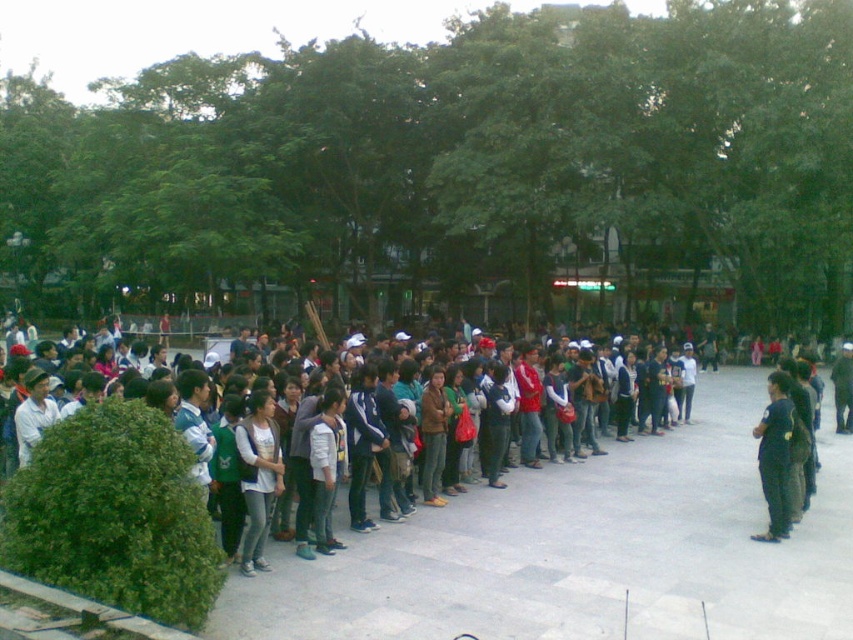
Measure the distance between light gray fabric jacket at center and dark blue uniform at center.

4.77 meters

Measure the distance between light gray fabric jacket at center and camera.

The distance of light gray fabric jacket at center from camera is 7.55 meters.

At what (x,y) coordinates should I click in order to perform the action: click on light gray fabric jacket at center. Please return your answer as a coordinate pair (x, y). This screenshot has width=853, height=640. Looking at the image, I should click on (258, 476).